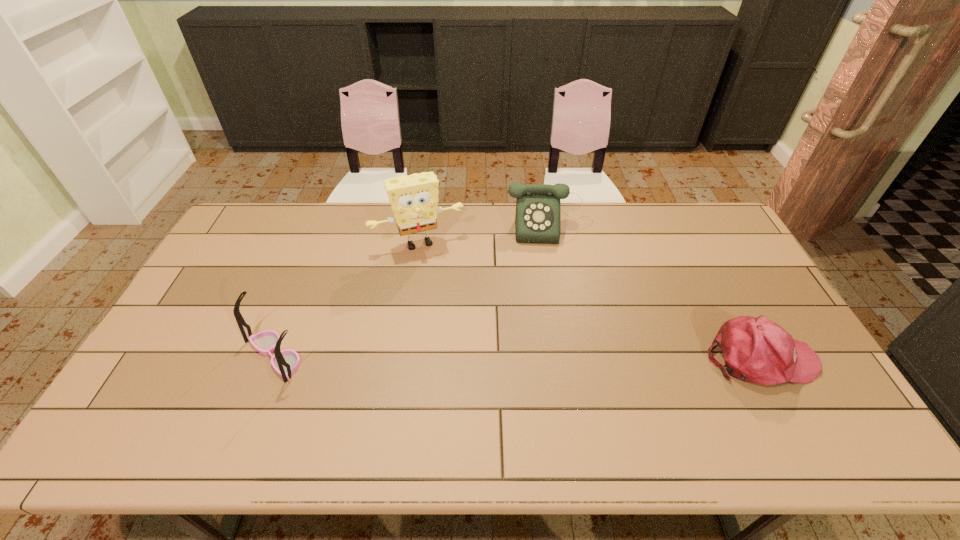
The image size is (960, 540). I want to click on free space on the desktop that is between the spectacles and the shortest object and is positioned on the dial of the third object from left to right, so click(564, 356).

Where is `free space on the desktop that is between the spectacles and the rightmost object and is positioned on the face of the tallest object`? The width and height of the screenshot is (960, 540). free space on the desktop that is between the spectacles and the rightmost object and is positioned on the face of the tallest object is located at coordinates (463, 356).